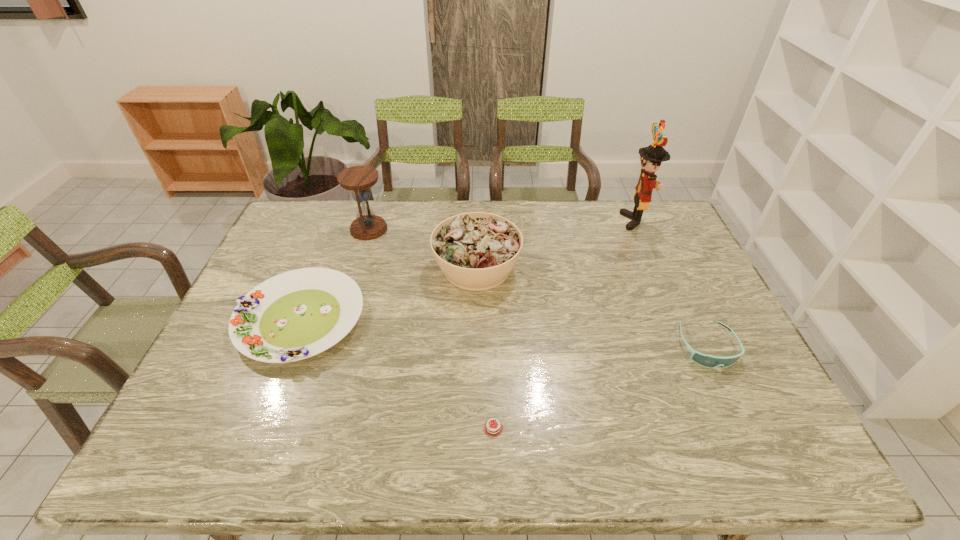
The image size is (960, 540). I want to click on vacant area that lies between the nearest object and the salad, so click(x=485, y=348).

Locate an element on the screen. Image resolution: width=960 pixels, height=540 pixels. vacant region between the salad plate and the salad is located at coordinates (389, 294).

Find the location of a particular element. Image resolution: width=960 pixels, height=540 pixels. unoccupied area between the salad and the salad plate is located at coordinates (389, 294).

Find the location of a particular element. This screenshot has width=960, height=540. free space between the fourth shortest object and the salad plate is located at coordinates (389, 294).

Locate an element on the screen. object that can be found as the fourth closest to the goggles is located at coordinates (295, 315).

Where is `object that is the fourth closest to the salad`? The height and width of the screenshot is (540, 960). object that is the fourth closest to the salad is located at coordinates (651, 157).

You are a GUI agent. You are given a task and a screenshot of the screen. Output one action in this format:
    pyautogui.click(x=<x>, y=<y>)
    Task: Click on the free region that satisfies the following two spatial constraints: 1. on the back side of the salad plate; 2. on the left side of the fourth shortest object
    Image resolution: width=960 pixels, height=540 pixels.
    Given the screenshot: What is the action you would take?
    pyautogui.click(x=321, y=268)

You are a GUI agent. You are given a task and a screenshot of the screen. Output one action in this format:
    pyautogui.click(x=<x>, y=<y>)
    Task: Click on the free space in the image that satisfies the following two spatial constraints: 1. on the back side of the salad plate; 2. on the left side of the third tallest object
    The height and width of the screenshot is (540, 960).
    Given the screenshot: What is the action you would take?
    pyautogui.click(x=321, y=268)